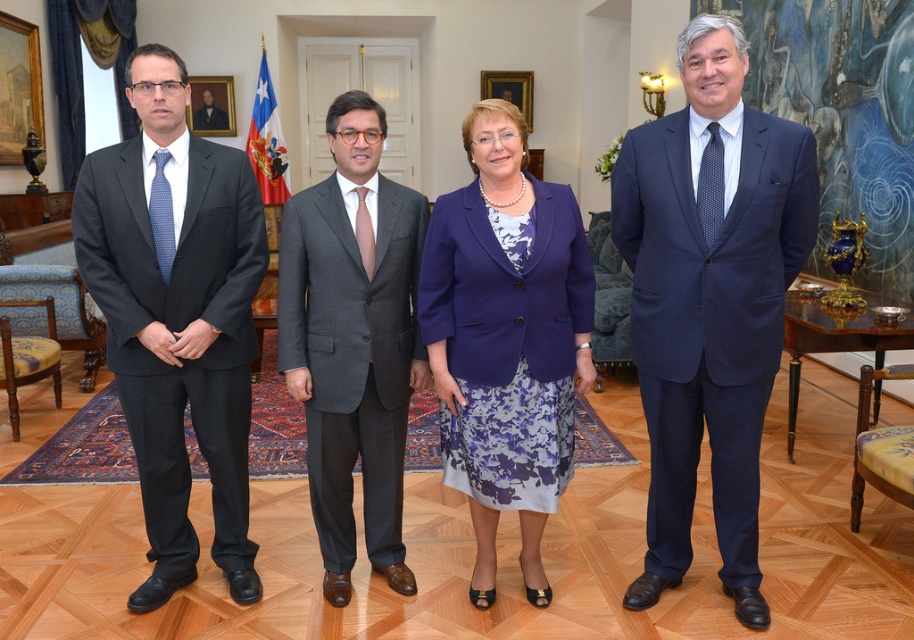
You are a photographer setting up for a group photo. You notice two points marked in the scene. The first point, point (654, 275), is where you want to position the tallest person, and the second point, point (168, 467), is where you want to place the shortest person. Based on their positions, which person should be placed at which point?

Point (654, 275) is in front of point (168, 467). Therefore, the tallest person should be placed at point (654, 275) to ensure they are visible in the photo, while the shorter person should be positioned at point (168, 467) behind them.

You are a photographer setting up for a group photo in a room with a large abstract painting on the right wall. You notice a point marked at coordinates [177,316]. What object is located at that point?

The point at coordinates [177,316] indicates the location of the matte black suit at left.

You are a photographer setting up for a group photo. You have two subjects wearing the navy blue suit at right and the matte black suit at left. Which subject should you position closer to the camera to ensure both appear the same size in the photo?

The navy blue suit at right is larger in size than the matte black suit at left. To make them appear the same size in the photo, position the smaller matte black suit at left closer to the camera.